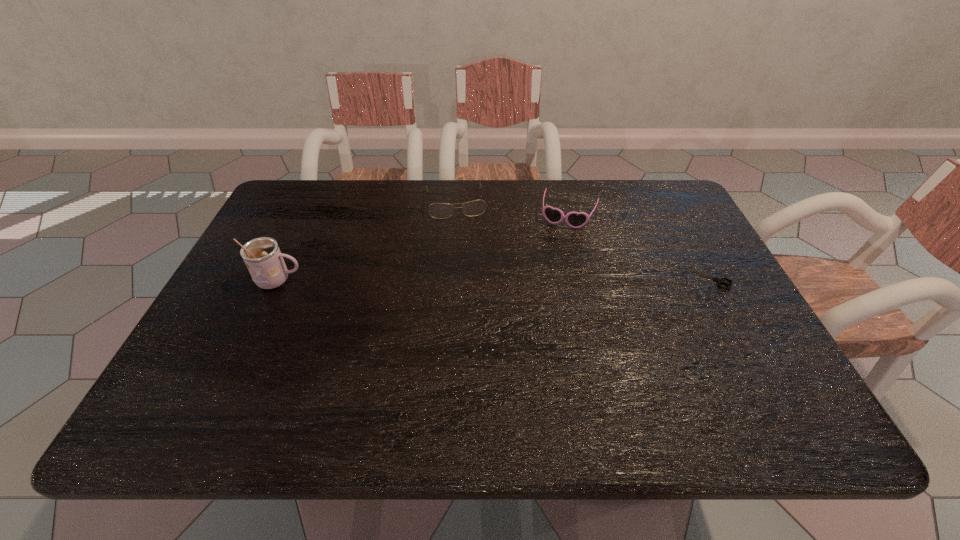
In the image, there is a desktop. Where is `vacant space at the left edge`? This screenshot has width=960, height=540. vacant space at the left edge is located at coordinates (254, 326).

In the image, there is a desktop. Where is `vacant area at the right edge`? This screenshot has height=540, width=960. vacant area at the right edge is located at coordinates (689, 326).

Find the location of `vacant region at the far left corner of the desktop`. vacant region at the far left corner of the desktop is located at coordinates (320, 208).

In the image, there is a desktop. Where is `free space at the far right corner`? This screenshot has height=540, width=960. free space at the far right corner is located at coordinates (630, 187).

What are the coordinates of `free point between the second object from right to left and the shears` in the screenshot? It's located at (639, 247).

Locate an element on the screen. The width and height of the screenshot is (960, 540). vacant space in between the sunglasses and the shears is located at coordinates (639, 247).

This screenshot has width=960, height=540. I want to click on blank region between the sunglasses and the shortest object, so click(639, 247).

Identify the location of empty space that is in between the tallest object and the second object from right to left. The width and height of the screenshot is (960, 540). (423, 248).

Identify the location of free space between the cup and the third object from right to left. The image size is (960, 540). (367, 241).

Where is `free spot between the leftmost object and the second object from left to right`? The height and width of the screenshot is (540, 960). free spot between the leftmost object and the second object from left to right is located at coordinates (367, 241).